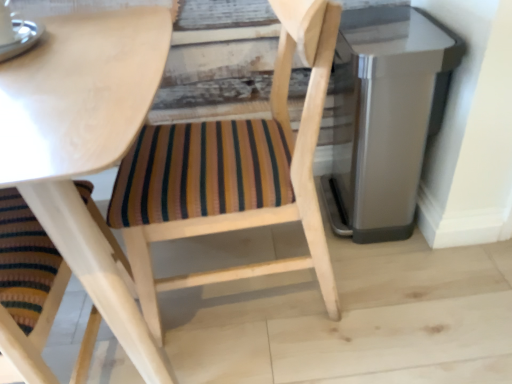
Locate an element on the screen. empty space that is to the right of wooden chair with striped cushion at center is located at coordinates (414, 306).